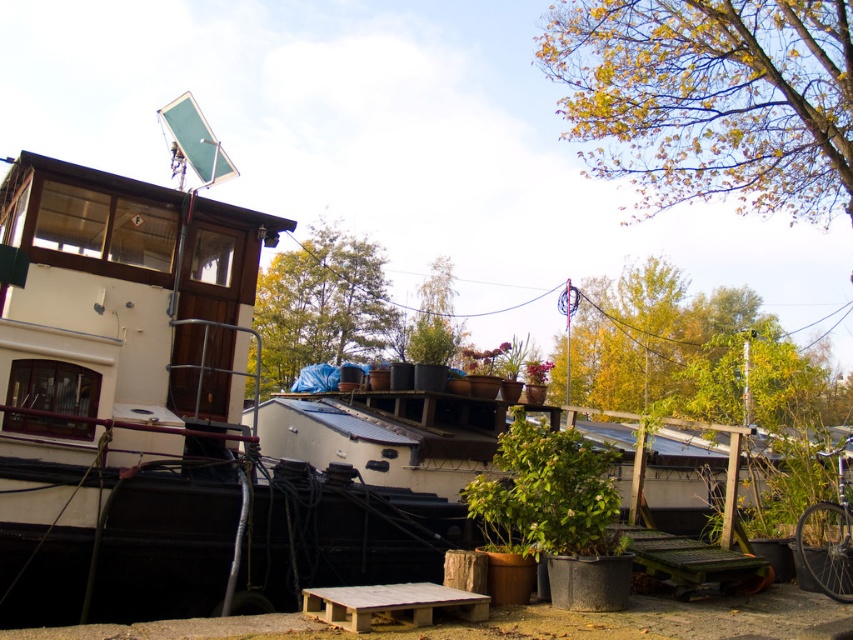
Question: Which object appears closest to the camera in this image?

Choices:
 (A) white matte boat at upper left
 (B) wooden pallet at center

Answer: (B)

Question: Does white matte boat at upper left have a smaller size compared to wooden pallet at center?

Choices:
 (A) no
 (B) yes

Answer: (A)

Question: Which of the following is the closest to the observer?

Choices:
 (A) (447, 595)
 (B) (270, 307)
 (C) (589, 456)
 (D) (79, 387)

Answer: (A)

Question: Which of the following is the closest to the observer?

Choices:
 (A) (228, 332)
 (B) (396, 618)

Answer: (B)

Question: Is yellow leafy branches at upper right closer to the viewer compared to wooden pallet at center?

Choices:
 (A) no
 (B) yes

Answer: (A)

Question: Does green leafy tree at upper center have a smaller size compared to wooden pallet at center?

Choices:
 (A) no
 (B) yes

Answer: (A)